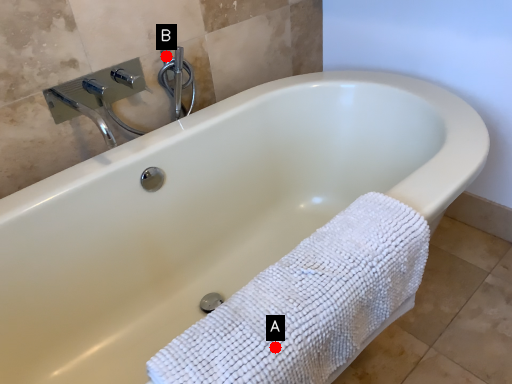
Question: Two points are circled on the image, labeled by A and B beside each circle. Among these points, which one is nearest to the camera?

Choices:
 (A) A is closer
 (B) B is closer

Answer: (A)